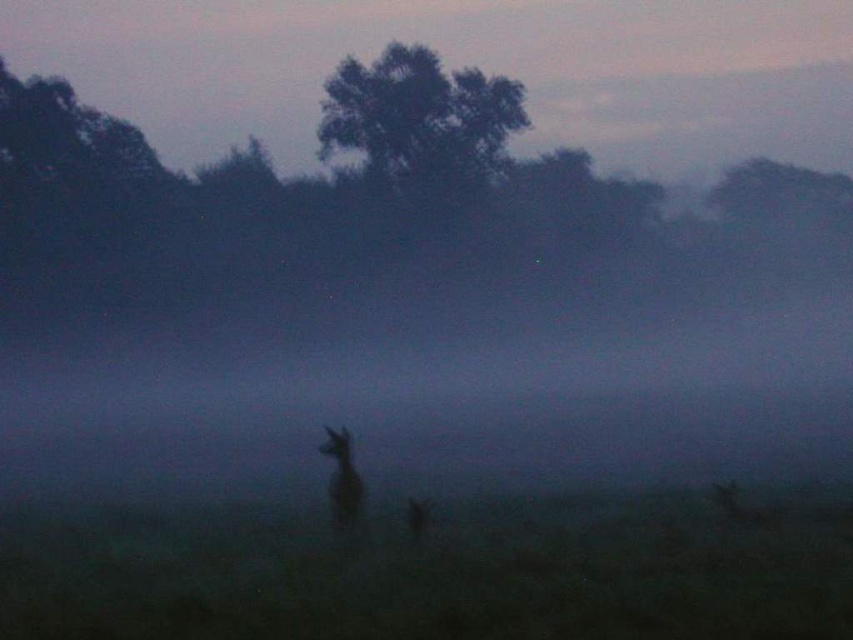
You are a hiker trying to estimate distances in the misty landscape. You see the green leafy tree at upper center and the fuzzy brown deer at center. How far apart are these two objects?

The green leafy tree at upper center and the fuzzy brown deer at center are 39.00 meters apart.

Based on the photo, you are standing in the misty landscape depicted in the scene. You want to locate the green leafy tree at upper center. Based on the coordinates provided, which direction should you look to find it?

The green leafy tree at upper center is located at coordinates point (421, 122), so you should look towards the upper center direction to find it.